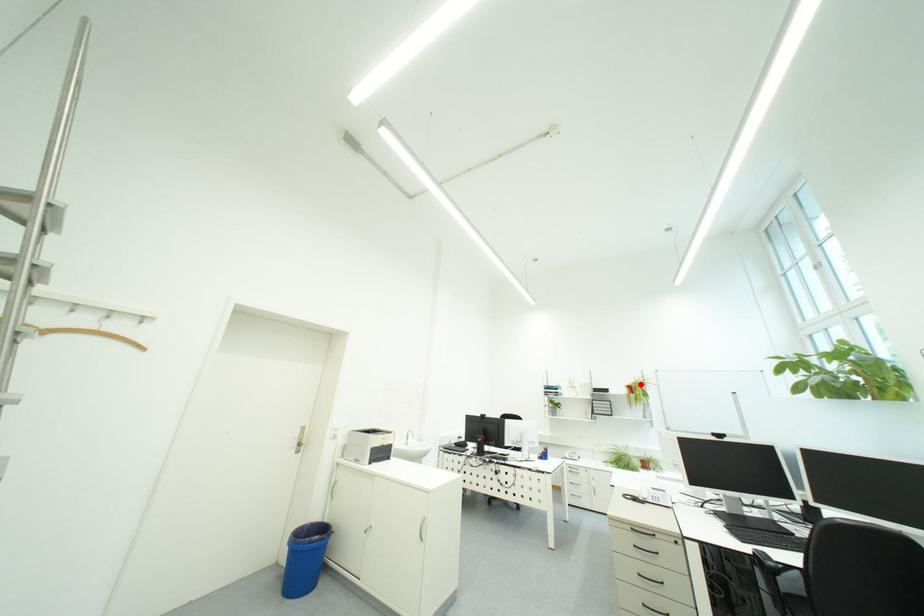
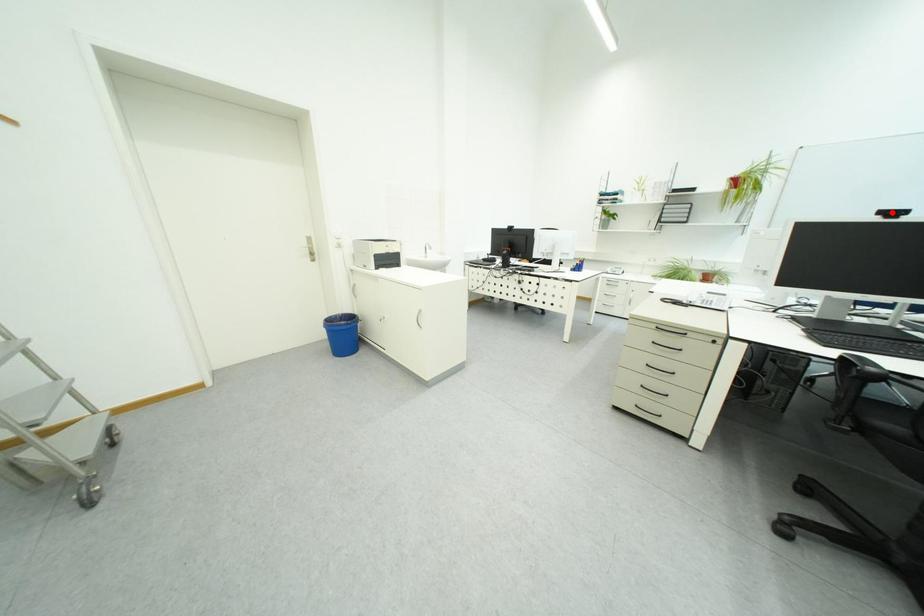
I am providing you with two images of the same scene from different viewpoints. A red point is marked on the first image and another point is marked on the second image. Do the highlighted points in image1 and image2 indicate the same real-world spot?

No